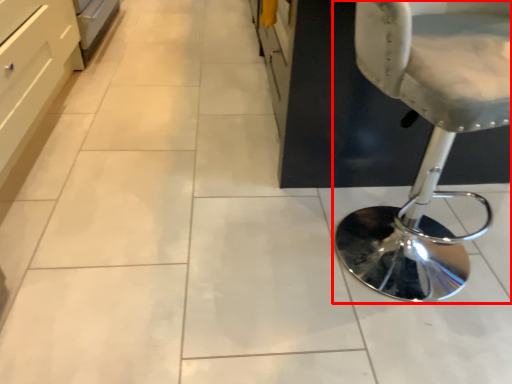
Question: From the image's perspective, considering the relative positions of chair (annotated by the red box) and drawer in the image provided, where is chair (annotated by the red box) located with respect to the staircase?

Choices:
 (A) below
 (B) above

Answer: (A)